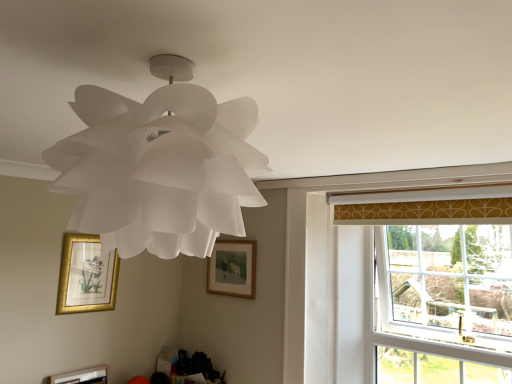
Question: From the image's perspective, is white paper lamp at upper center positioned above or below gold framed picture at lower left, which ranks as the 2th picture frame in left-to-right order?

Choices:
 (A) above
 (B) below

Answer: (A)

Question: Which is correct: white paper lamp at upper center is inside gold framed picture at lower left, which ranks as the 2th picture frame in left-to-right order, or outside of it?

Choices:
 (A) outside
 (B) inside

Answer: (A)

Question: Estimate the real-world distances between objects in this image. Which object is closer to the wooden framed picture at center, the first picture frame viewed from the right?

Choices:
 (A) wooden picture frame at lower left, which appears as the 3th picture frame when viewed from the right
 (B) clear glass window at right
 (C) white paper lamp at upper center
 (D) gold framed picture at lower left, positioned as the 2th picture frame in top-to-bottom order

Answer: (D)

Question: Based on their relative distances, which object is nearer to the clear glass window at right?

Choices:
 (A) wooden framed picture at center, which is counted as the third picture frame, starting from the bottom
 (B) wooden picture frame at lower left, which appears as the 1th picture frame when viewed from the left
 (C) white paper lamp at upper center
 (D) gold framed picture at lower left, which is counted as the second picture frame, starting from the right

Answer: (A)